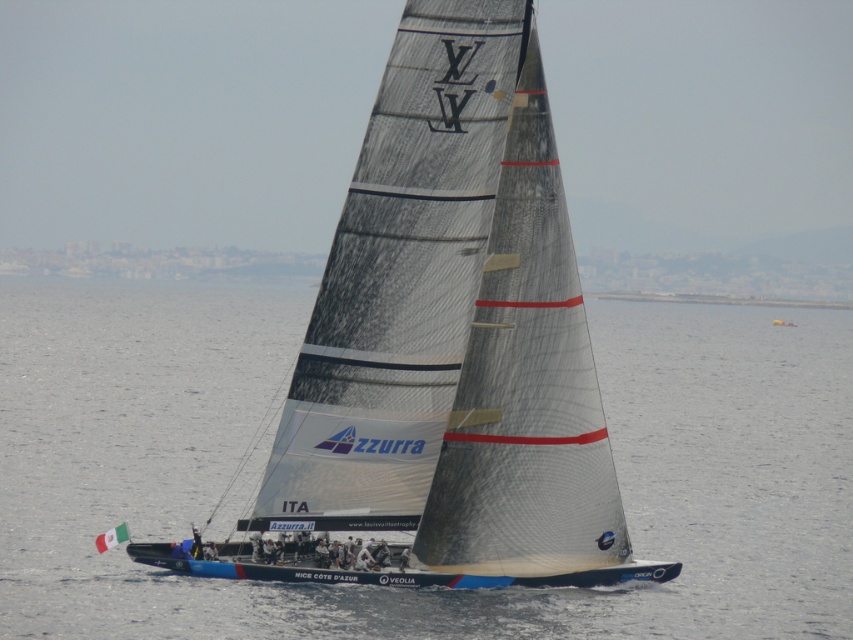
You are a photographer trying to capture the sailboat and the water in the image. Since you want to focus on the sailboat, which object should you adjust your camera to be closer to, the transparent water at center or the white matte sailboat at center?

You should adjust your camera to be closer to the white matte sailboat at center. Since the transparent water at center is wider than the white matte sailboat at center, moving closer to the boat will help focus on it while maintaining the desired framing.

You are an observer standing on the shore looking at the transparent water at center and the white matte sailboat at center. Which object is closer to you?

The transparent water at center is closer to you than the white matte sailboat at center because it is further to the viewer.

You are a photographer trying to capture the sailboat and the water in the image. Which object, the transparent water at center or the white matte sailboat at center, appears taller in the photo?

The transparent water at center appears taller than the white matte sailboat at center in the photo.